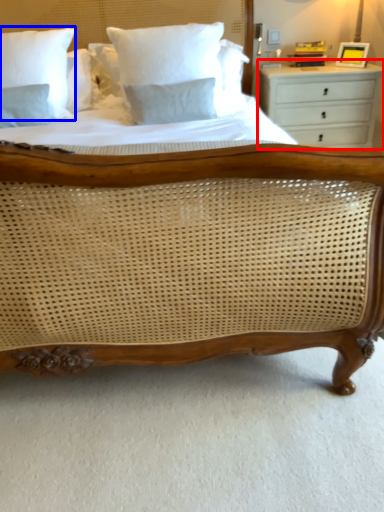
Question: Which object is further to the camera taking this photo, chest of drawers (highlighted by a red box) or pillow (highlighted by a blue box)?

Choices:
 (A) chest of drawers
 (B) pillow

Answer: (A)